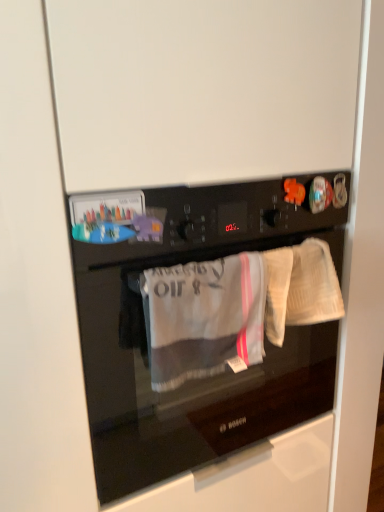
Locate an element on the screen. The image size is (384, 512). black glass oven at center is located at coordinates (209, 377).

Is gray cotton towel at center in contact with white textured towel at right?

No.

Can you tell me how much gray cotton towel at center and white textured towel at right differ in facing direction?

There is a 2.72-degree angle between the facing directions of gray cotton towel at center and white textured towel at right.

Considering the positions of objects gray cotton towel at center and white textured towel at right in the image provided, who is in front, gray cotton towel at center or white textured towel at right?

gray cotton towel at center is more forward.

Can you confirm if gray cotton towel at center is thinner than white textured towel at right?

No, gray cotton towel at center is not thinner than white textured towel at right.

Is white textured towel at right looking in the opposite direction of black glass oven at center?

Yes, white textured towel at right's orientation is away from black glass oven at center.

Looking at this image, between white textured towel at right and black glass oven at center, which one has larger size?

black glass oven at center.

Locate an element on the screen. The image size is (384, 512). home appliance on the left of white textured towel at right is located at coordinates (209, 377).

Is white textured towel at right spatially inside black glass oven at center, or outside of it?

The correct answer is: outside.

From a real-world perspective, is black glass oven at center positioned over gray cotton towel at center based on gravity?

Incorrect, from a real-world perspective, black glass oven at center is lower than gray cotton towel at center.

Consider the image. Who is smaller, black glass oven at center or gray cotton towel at center?

With smaller size is gray cotton towel at center.

What are the coordinates of `clothing that appears on the right of black glass oven at center` in the screenshot? It's located at (204, 317).

From the image's perspective, which one is positioned lower, black glass oven at center or gray cotton towel at center?

gray cotton towel at center.

Considering the positions of objects black glass oven at center and white textured towel at right in the image provided, who is in front, black glass oven at center or white textured towel at right?

black glass oven at center is closer to the camera.

Is black glass oven at center placed right next to white textured towel at right?

black glass oven at center and white textured towel at right are clearly separated.

Considering the relative sizes of black glass oven at center and white textured towel at right in the image provided, is black glass oven at center smaller than white textured towel at right?

No, black glass oven at center is not smaller than white textured towel at right.

Find the location of `baby clothe behind the black glass oven at center`. baby clothe behind the black glass oven at center is located at coordinates (300, 288).

Who is smaller, gray cotton towel at center or black glass oven at center?

gray cotton towel at center is smaller.

Between point (243, 318) and point (205, 446), which one is positioned behind?

The point (205, 446) is farther from the camera.

Is gray cotton towel at center aimed at black glass oven at center?

No, gray cotton towel at center is not turned towards black glass oven at center.

From a real-world perspective, does gray cotton towel at center sit lower than black glass oven at center?

No.

Would you say white textured towel at right is outside gray cotton towel at center?

white textured towel at right lies outside gray cotton towel at center's area.

Which is closer to the camera, (268, 321) or (156, 379)?

Clearly, point (268, 321) is more distant from the camera than point (156, 379).

Is white textured towel at right directly adjacent to gray cotton towel at center?

There is a gap between white textured towel at right and gray cotton towel at center.

Can you tell me how much white textured towel at right and gray cotton towel at center differ in facing direction?

The angle between the facing direction of white textured towel at right and the facing direction of gray cotton towel at center is 2.72 degrees.

At what (x,y) coordinates should I click in order to perform the action: click on baby clothe positioned vertically above the gray cotton towel at center (from a real-world perspective). Please return your answer as a coordinate pair (x, y). The width and height of the screenshot is (384, 512). Looking at the image, I should click on pyautogui.click(x=300, y=288).

Identify the location of baby clothe behind the black glass oven at center. The height and width of the screenshot is (512, 384). (300, 288).

Looking at the image, which one is located closer to gray cotton towel at center, black glass oven at center or white textured towel at right?

black glass oven at center is closer to gray cotton towel at center.

When comparing their distances from white textured towel at right, does gray cotton towel at center or black glass oven at center seem closer?

gray cotton towel at center lies closer to white textured towel at right than the other object.

From the image, which object appears to be farther from gray cotton towel at center, white textured towel at right or black glass oven at center?

Based on the image, white textured towel at right appears to be further to gray cotton towel at center.

When comparing their distances from white textured towel at right, does black glass oven at center or gray cotton towel at center seem further?

black glass oven at center is further to white textured towel at right.

Considering their positions, is white textured towel at right positioned further to black glass oven at center than gray cotton towel at center?

white textured towel at right is further to black glass oven at center.

From the image, which object appears to be nearer to black glass oven at center, gray cotton towel at center or white textured towel at right?

Based on the image, gray cotton towel at center appears to be nearer to black glass oven at center.

Where is `clothing between black glass oven at center and white textured towel at right`? Image resolution: width=384 pixels, height=512 pixels. clothing between black glass oven at center and white textured towel at right is located at coordinates (204, 317).